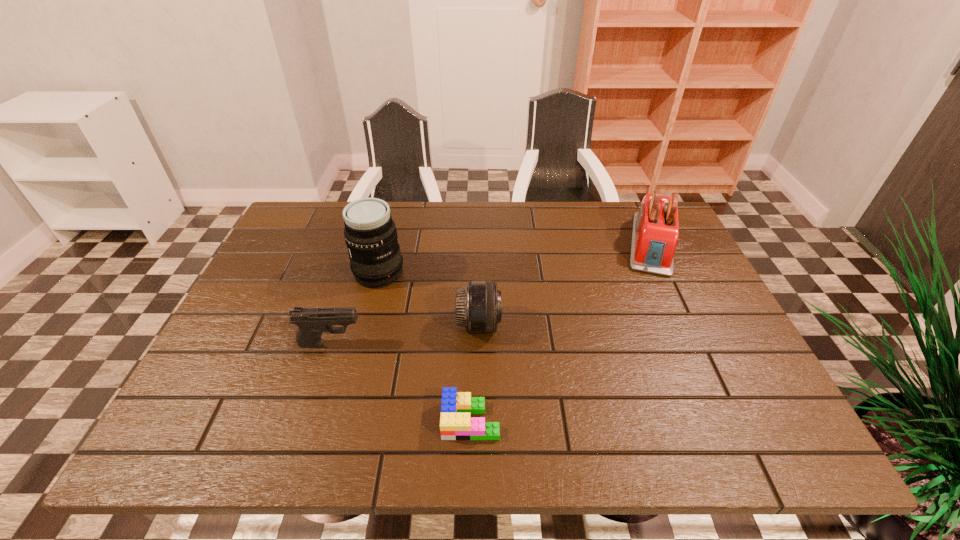
Find the location of a particular element. Image resolution: width=960 pixels, height=540 pixels. the left telephoto lens is located at coordinates (370, 233).

Where is `the taller telephoto lens`? Image resolution: width=960 pixels, height=540 pixels. the taller telephoto lens is located at coordinates click(370, 233).

Where is `the second tallest object`? The height and width of the screenshot is (540, 960). the second tallest object is located at coordinates (655, 234).

Image resolution: width=960 pixels, height=540 pixels. Identify the location of toaster. (655, 234).

You are a GUI agent. You are given a task and a screenshot of the screen. Output one action in this format:
    pyautogui.click(x=<x>, y=<y>)
    Task: Click on the right telephoto lens
    The height and width of the screenshot is (540, 960).
    Given the screenshot: What is the action you would take?
    pyautogui.click(x=478, y=305)

Locate an element on the screen. the shorter telephoto lens is located at coordinates (478, 305).

Image resolution: width=960 pixels, height=540 pixels. I want to click on pistol, so click(311, 322).

At what (x,y) coordinates should I click in order to perform the action: click on the nearest object. Please return your answer as a coordinate pair (x, y). The height and width of the screenshot is (540, 960). Looking at the image, I should click on (x=455, y=422).

Find the location of a particular element. Lego is located at coordinates (455, 422).

Locate an element on the screen. vacant space located on the left of the taller telephoto lens is located at coordinates (324, 273).